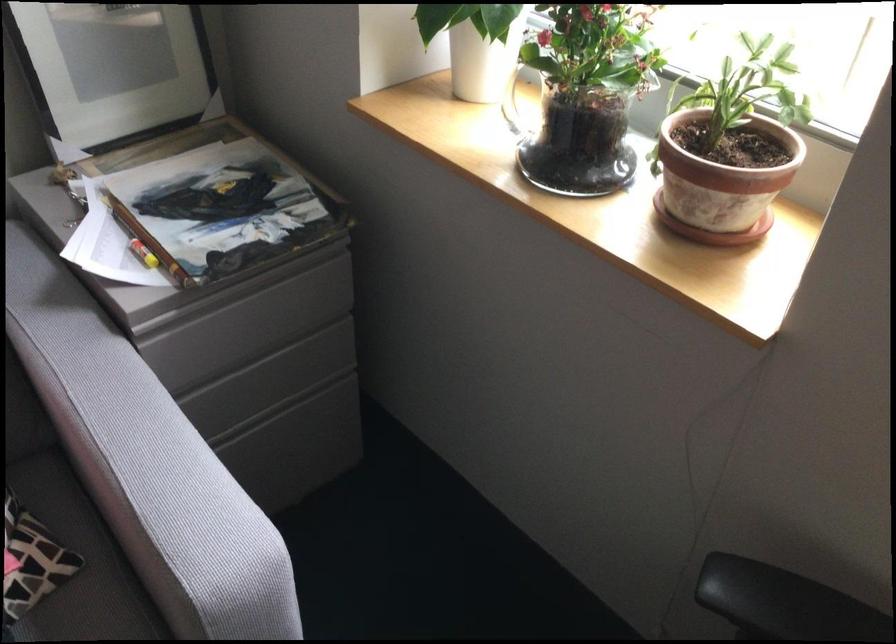
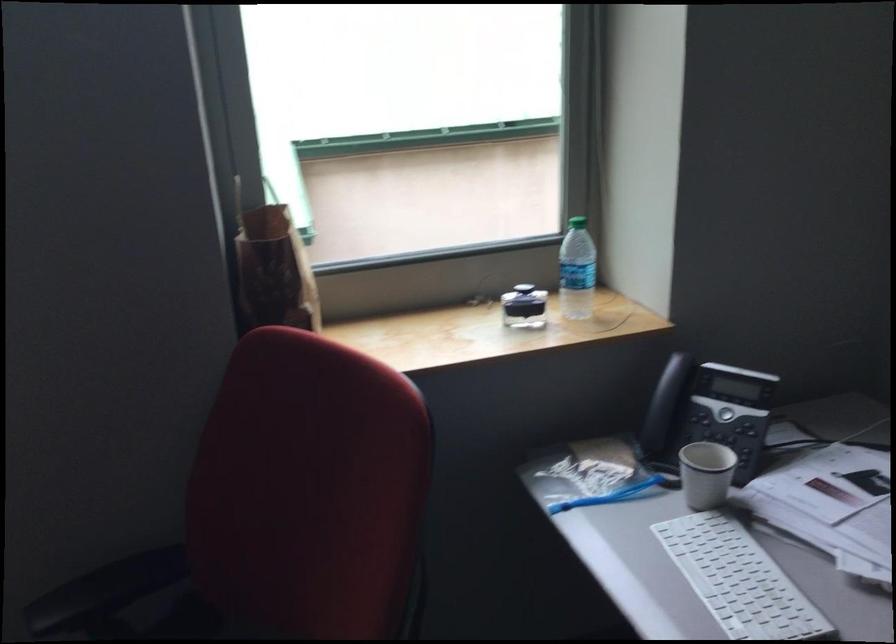
Question: How did the camera likely rotate?

Choices:
 (A) Left
 (B) Right
 (C) Up
 (D) Down

Answer: (B)